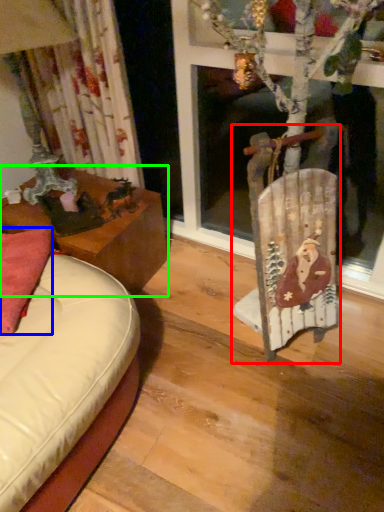
Question: Estimate the real-world distances between objects in this image. Which object is closer to chair (highlighted by a red box), pillow (highlighted by a blue box) or table (highlighted by a green box)?

Choices:
 (A) pillow
 (B) table

Answer: (B)